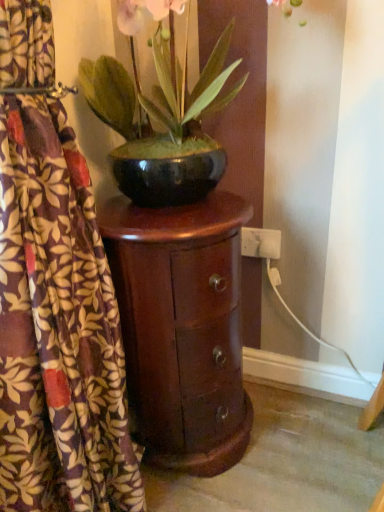
The image size is (384, 512). In order to click on vacant point above glossy wood nightstand at left (from a real-world perspective) in this screenshot , I will do `click(172, 207)`.